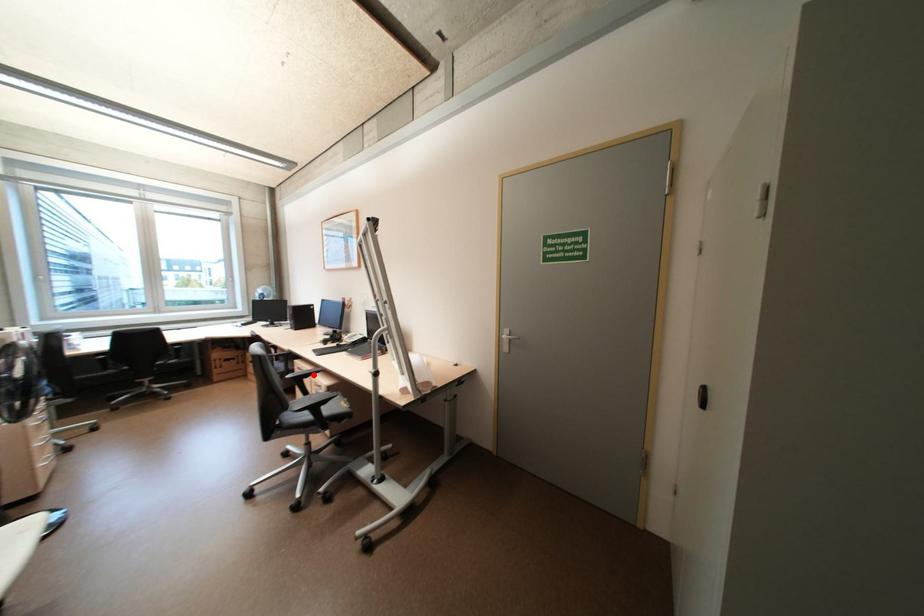
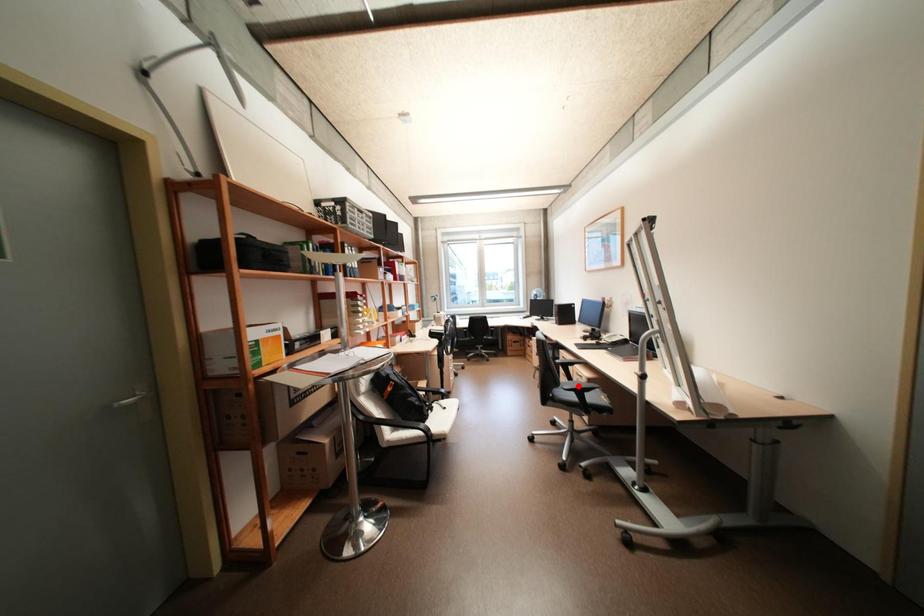
I am providing you with two images of the same scene from different viewpoints. A red point is marked on the first image and another point is marked on the second image. Is the red point in image1 aligned with the point shown in image2?

No